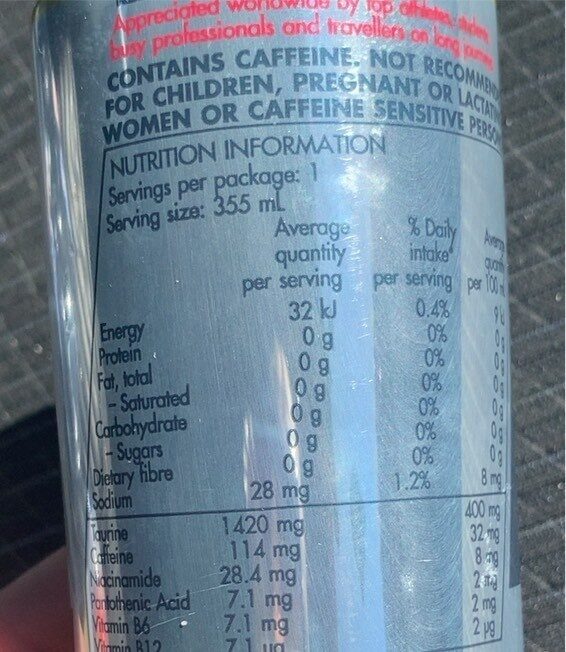
Locate an element on the screen. grout is located at coordinates (537, 85).